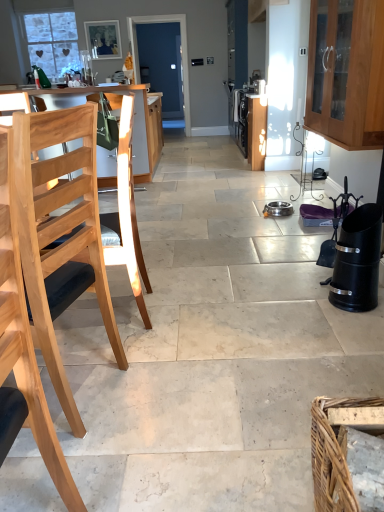
I want to click on free location in front of natural wood chair at left, so click(78, 470).